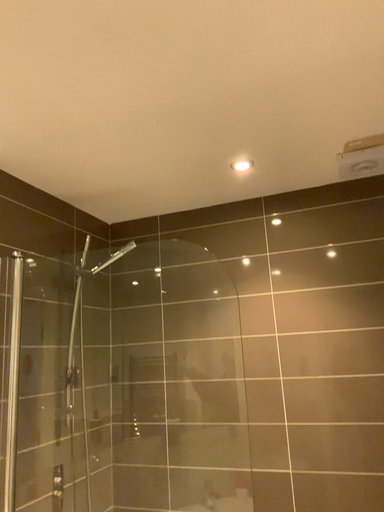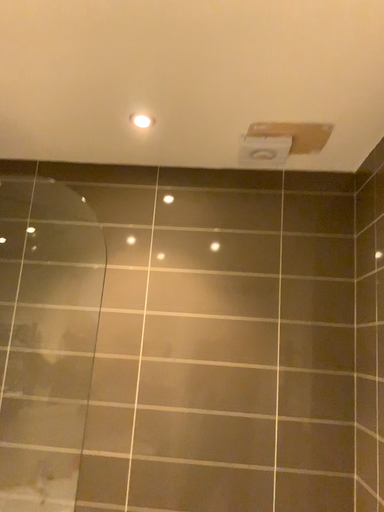
Question: Which way did the camera rotate in the video?

Choices:
 (A) rotated right
 (B) rotated left

Answer: (A)